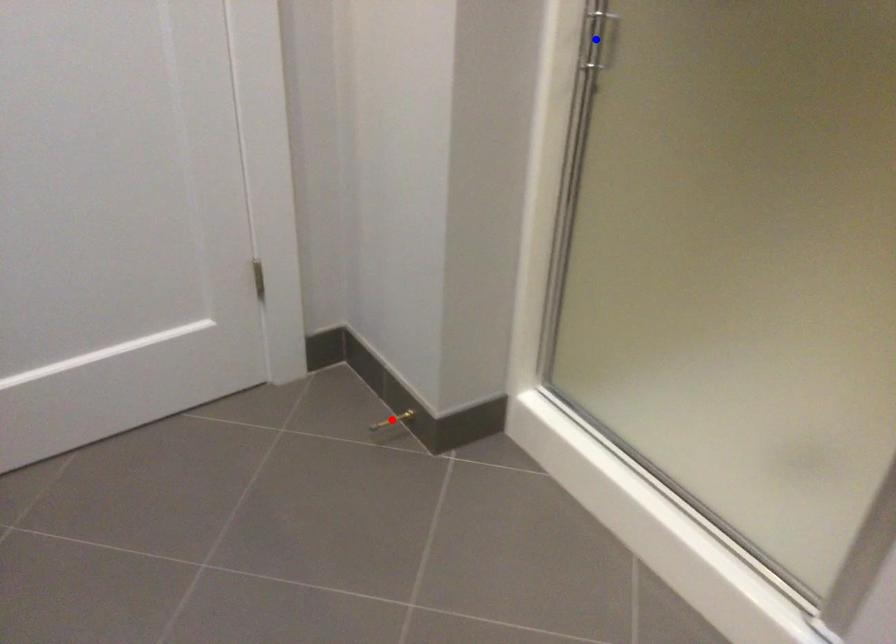
Question: In the image, two points are highlighted. Which point is nearer to the camera? Reply with the corresponding letter.

Choices:
 (A) blue point
 (B) red point

Answer: (A)